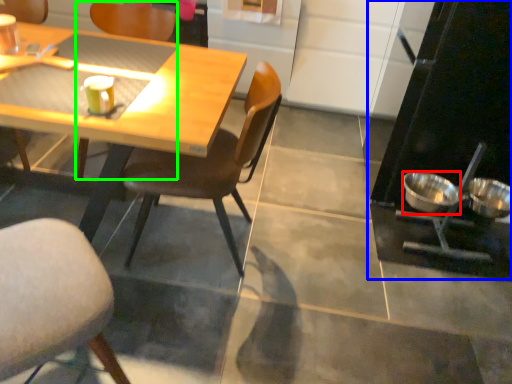
Question: Considering the real-world distances, which object is farthest from bowl (highlighted by a red box)? appliance (highlighted by a blue box) or chair (highlighted by a green box)?

Choices:
 (A) appliance
 (B) chair

Answer: (B)